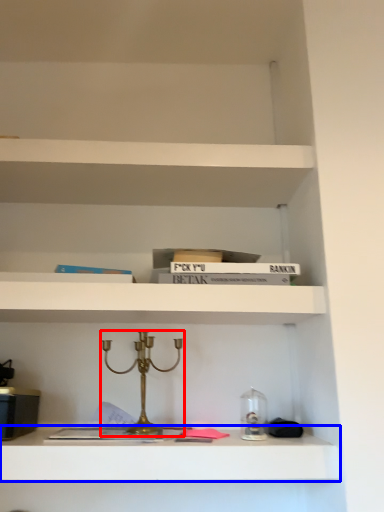
Question: Which of the following is the farthest to the observer, candle holder (highlighted by a red box) or shelf (highlighted by a blue box)?

Choices:
 (A) candle holder
 (B) shelf

Answer: (A)